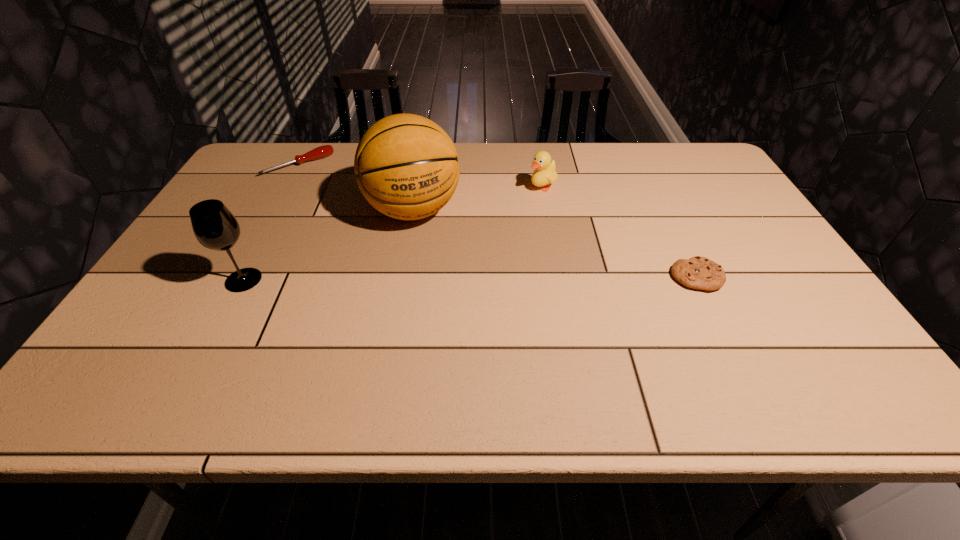
Image resolution: width=960 pixels, height=540 pixels. I want to click on vacant space positioned on the surface of the third object from right to left near the brand logo, so click(x=464, y=359).

You are a GUI agent. You are given a task and a screenshot of the screen. Output one action in this format:
    pyautogui.click(x=<x>, y=<y>)
    Task: Click on the free region located on the surface of the third object from right to left near the brand logo
    The width and height of the screenshot is (960, 540).
    Given the screenshot: What is the action you would take?
    pyautogui.click(x=439, y=286)

The image size is (960, 540). Find the location of `vacant space located on the surface of the third object from right to left near the brand logo`. vacant space located on the surface of the third object from right to left near the brand logo is located at coordinates (433, 269).

I want to click on vacant space located at the tip of the screwdriver, so click(324, 188).

You are a GUI agent. You are given a task and a screenshot of the screen. Output one action in this format:
    pyautogui.click(x=<x>, y=<y>)
    Task: Click on the free location located at the tip of the screwdriver
    The height and width of the screenshot is (540, 960).
    Given the screenshot: What is the action you would take?
    pyautogui.click(x=343, y=208)

This screenshot has height=540, width=960. I want to click on vacant space located at the tip of the screwdriver, so click(x=342, y=206).

Identify the location of free space located on the front-facing side of the duckling. The image size is (960, 540). (452, 246).

Image resolution: width=960 pixels, height=540 pixels. I want to click on vacant space located 0.380m on the front-facing side of the duckling, so click(x=441, y=254).

You are a GUI agent. You are given a task and a screenshot of the screen. Output one action in this format:
    pyautogui.click(x=<x>, y=<y>)
    Task: Click on the vacant position located 0.390m on the front-facing side of the duckling
    The height and width of the screenshot is (540, 960).
    Given the screenshot: What is the action you would take?
    pyautogui.click(x=438, y=255)

Image resolution: width=960 pixels, height=540 pixels. I want to click on screwdriver situated at the far edge, so click(x=320, y=152).